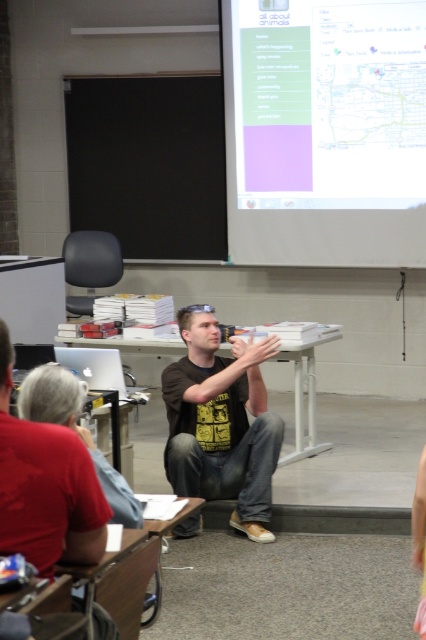
The image size is (426, 640). Describe the element at coordinates (221, 422) in the screenshot. I see `black cotton t-shirt at center` at that location.

Find the location of a particular element. black cotton t-shirt at center is located at coordinates (221, 422).

Can you confirm if matte black laptop at left is thinner than white plastic table at center?

Yes.

The width and height of the screenshot is (426, 640). What do you see at coordinates (46, 486) in the screenshot? I see `matte black laptop at left` at bounding box center [46, 486].

Identify the location of matte black laptop at left. Image resolution: width=426 pixels, height=640 pixels. (46, 486).

Describe the element at coordinates (325, 131) in the screenshot. I see `white matte projection screen at upper center` at that location.

Is white matte projection screen at upper center shorter than red shirt at left?

No.

Does point (238, 93) lie in front of point (23, 378)?

No, (238, 93) is further to viewer.

What are the coordinates of `white matte projection screen at upper center` in the screenshot? It's located at (325, 131).